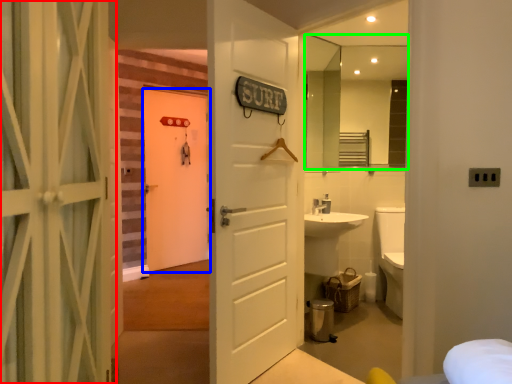
Question: Which is farther away from door (highlighted by a red box)? door (highlighted by a blue box) or mirror (highlighted by a green box)?

Choices:
 (A) door
 (B) mirror

Answer: (A)